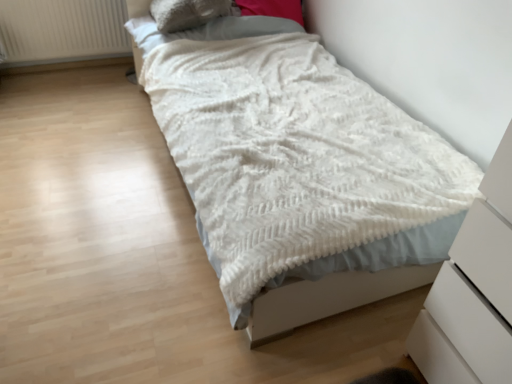
You are a GUI agent. You are given a task and a screenshot of the screen. Output one action in this format:
    pyautogui.click(x=<x>, y=<y>)
    Task: Click on the white matte chest of drawers at lower right
    The width and height of the screenshot is (512, 384).
    Given the screenshot: What is the action you would take?
    pyautogui.click(x=473, y=292)

Based on the photo, between white textured radiator at upper left and white matte chest of drawers at lower right, which one has less height?

white textured radiator at upper left.

Which of these two, white textured radiator at upper left or white matte chest of drawers at lower right, is smaller?

Smaller between the two is white textured radiator at upper left.

Looking at this image, between white textured radiator at upper left and white matte chest of drawers at lower right, which one has smaller width?

With smaller width is white textured radiator at upper left.

Is white matte chest of drawers at lower right at the back of white textured radiator at upper left?

white textured radiator at upper left does not have its back to white matte chest of drawers at lower right.

How far apart are white matte chest of drawers at lower right and white textured blanket at center?

A distance of 41.29 centimeters exists between white matte chest of drawers at lower right and white textured blanket at center.

Is the depth of white matte chest of drawers at lower right greater than that of white textured blanket at center?

No.

Which of these two, white matte chest of drawers at lower right or white textured blanket at center, stands taller?

With more height is white matte chest of drawers at lower right.

In terms of width, does white matte chest of drawers at lower right look wider or thinner when compared to white textured blanket at center?

Considering their sizes, white matte chest of drawers at lower right looks slimmer than white textured blanket at center.

This screenshot has height=384, width=512. Identify the location of bed on the right side of white textured radiator at upper left. (329, 298).

Considering the sizes of white textured blanket at center and white textured radiator at upper left in the image, is white textured blanket at center taller or shorter than white textured radiator at upper left?

Clearly, white textured blanket at center is taller compared to white textured radiator at upper left.

Is white textured blanket at center far away from white textured radiator at upper left?

white textured blanket at center is positioned a significant distance from white textured radiator at upper left.

Is white textured blanket at center inside the boundaries of white textured radiator at upper left, or outside?

white textured blanket at center is spatially situated outside white textured radiator at upper left.

From the image's perspective, which one is positioned higher, fuzzy beige pillow at upper center or white textured blanket at center?

fuzzy beige pillow at upper center appears higher in the image.

Who is taller, fuzzy beige pillow at upper center or white textured blanket at center?

Standing taller between the two is white textured blanket at center.

Is fuzzy beige pillow at upper center to the left of white textured blanket at center from the viewer's perspective?

Yes.

Could you tell me if fuzzy beige pillow at upper center is turned towards white textured radiator at upper left?

No, fuzzy beige pillow at upper center does not turn towards white textured radiator at upper left.

Would you say fuzzy beige pillow at upper center is to the left or to the right of white textured radiator at upper left in the picture?

From the image, it's evident that fuzzy beige pillow at upper center is to the right of white textured radiator at upper left.

Considering the sizes of fuzzy beige pillow at upper center and white textured radiator at upper left in the image, is fuzzy beige pillow at upper center wider or thinner than white textured radiator at upper left?

Considering their sizes, fuzzy beige pillow at upper center looks broader than white textured radiator at upper left.

From a real-world perspective, between fuzzy beige pillow at upper center and white textured radiator at upper left, who is vertically higher?

In real-world perspective, fuzzy beige pillow at upper center is above.

Does white matte chest of drawers at lower right appear on the left side of white textured radiator at upper left?

Incorrect, white matte chest of drawers at lower right is not on the left side of white textured radiator at upper left.

Considering the sizes of objects white matte chest of drawers at lower right and white textured radiator at upper left in the image provided, who is bigger, white matte chest of drawers at lower right or white textured radiator at upper left?

With larger size is white matte chest of drawers at lower right.

Could you tell me if white matte chest of drawers at lower right is facing white textured radiator at upper left?

No.

In the image, is white matte chest of drawers at lower right positioned in front of or behind white textured radiator at upper left?

Visually, white matte chest of drawers at lower right is located in front of white textured radiator at upper left.

Where is `pillow on the right of white textured radiator at upper left`? This screenshot has width=512, height=384. pillow on the right of white textured radiator at upper left is located at coordinates (188, 13).

From the image's perspective, is white textured radiator at upper left over fuzzy beige pillow at upper center?

Yes, from the image's perspective, white textured radiator at upper left is on top of fuzzy beige pillow at upper center.

Looking at this image, from a real-world perspective, between white textured radiator at upper left and fuzzy beige pillow at upper center, who is vertically lower?

white textured radiator at upper left, from a real-world perspective.

Where is `radiator above the white matte chest of drawers at lower right (from the image's perspective)`? This screenshot has width=512, height=384. radiator above the white matte chest of drawers at lower right (from the image's perspective) is located at coordinates (62, 31).

The width and height of the screenshot is (512, 384). Identify the location of bed that is on the left side of white matte chest of drawers at lower right. (329, 298).

Based on their spatial positions, is white textured blanket at center or fuzzy beige pillow at upper center closer to white matte chest of drawers at lower right?

Among the two, white textured blanket at center is located nearer to white matte chest of drawers at lower right.

Looking at the image, which one is located further to white textured radiator at upper left, white textured blanket at center or fuzzy beige pillow at upper center?

Among the two, white textured blanket at center is located further to white textured radiator at upper left.

Estimate the real-world distances between objects in this image. Which object is closer to white textured radiator at upper left, fuzzy beige pillow at upper center or white textured blanket at center?

Based on the image, fuzzy beige pillow at upper center appears to be nearer to white textured radiator at upper left.

Looking at the image, which one is located further to white textured blanket at center, white matte chest of drawers at lower right or white textured radiator at upper left?

white textured radiator at upper left.

Looking at the image, which one is located closer to white textured radiator at upper left, white matte chest of drawers at lower right or white textured blanket at center?

white textured blanket at center.

Which object lies further to the anchor point white matte chest of drawers at lower right, white textured radiator at upper left or fuzzy beige pillow at upper center?

white textured radiator at upper left is positioned further to the anchor white matte chest of drawers at lower right.

Considering their positions, is fuzzy beige pillow at upper center positioned closer to white textured blanket at center than white textured radiator at upper left?

fuzzy beige pillow at upper center is positioned closer to the anchor white textured blanket at center.

Looking at the image, which one is located further to fuzzy beige pillow at upper center, white textured radiator at upper left or white matte chest of drawers at lower right?

Based on the image, white matte chest of drawers at lower right appears to be further to fuzzy beige pillow at upper center.

This screenshot has width=512, height=384. What are the coordinates of `pillow between white textured blanket at center and white textured radiator at upper left in the front-back direction` in the screenshot? It's located at (188, 13).

This screenshot has height=384, width=512. What are the coordinates of `bed between white matte chest of drawers at lower right and fuzzy beige pillow at upper center in the front-back direction` in the screenshot? It's located at (329, 298).

This screenshot has width=512, height=384. Identify the location of pillow between white textured radiator at upper left and white matte chest of drawers at lower right from left to right. (188, 13).

Find the location of a particular element. bed between white matte chest of drawers at lower right and white textured radiator at upper left from front to back is located at coordinates (329, 298).